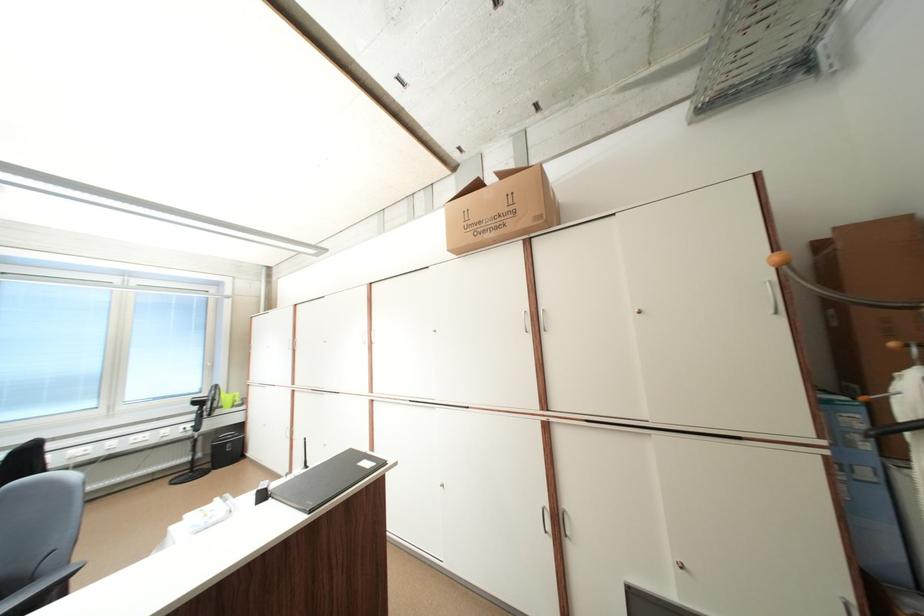
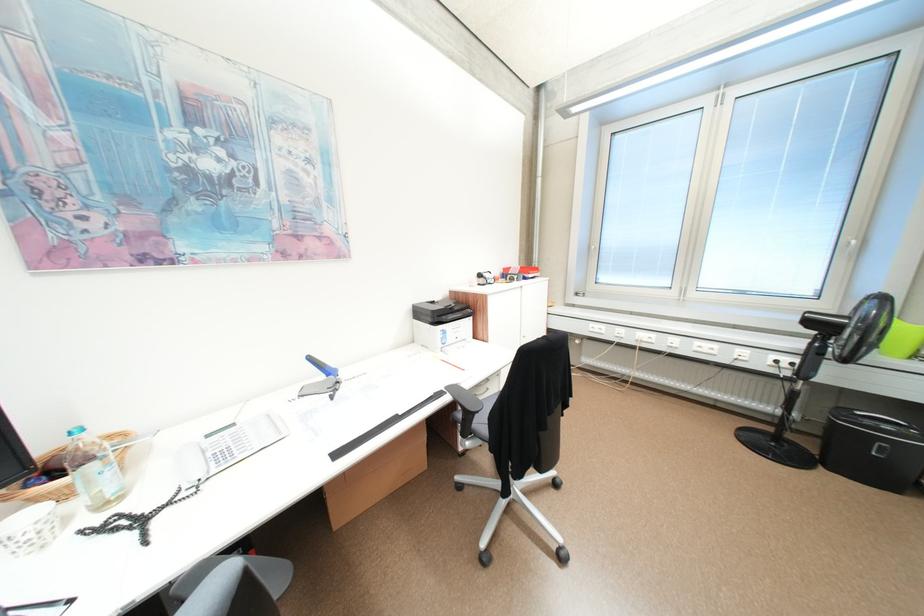
Where in the second image is the point corresponding to [209,419] from the first image?

(822, 357)